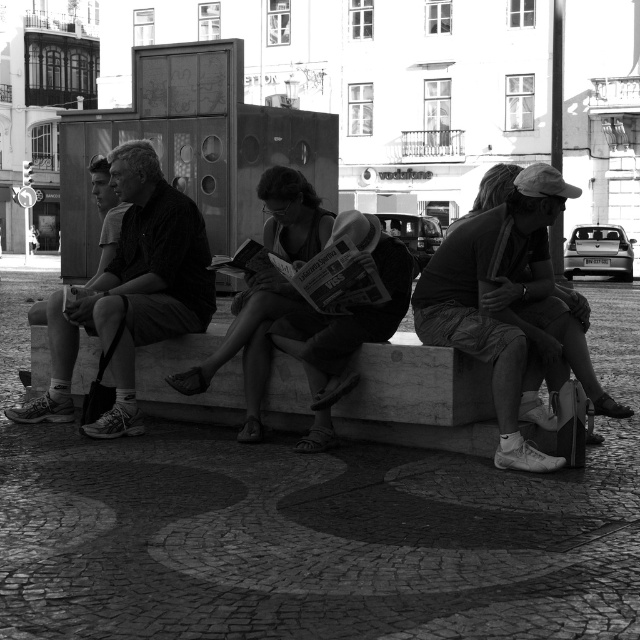
Question: Considering the relative positions of marble bench at center and smooth black shirt at left in the image provided, where is marble bench at center located with respect to smooth black shirt at left?

Choices:
 (A) above
 (B) below

Answer: (B)

Question: Which object appears closest to the camera in this image?

Choices:
 (A) marble bench at center
 (B) smooth black shirt at left

Answer: (A)

Question: Does smooth black shirt at left come behind matte black cap at center?

Choices:
 (A) yes
 (B) no

Answer: (A)

Question: Which object is closer to the camera taking this photo?

Choices:
 (A) marble bench at center
 (B) matte black dress at center
 (C) matte black cap at center
 (D) smooth black shirt at left

Answer: (A)

Question: Can you confirm if marble bench at center is positioned below matte black cap at center?

Choices:
 (A) yes
 (B) no

Answer: (A)

Question: Which of the following is the farthest from the observer?

Choices:
 (A) matte black dress at center
 (B) marble bench at center
 (C) smooth black shirt at left

Answer: (C)